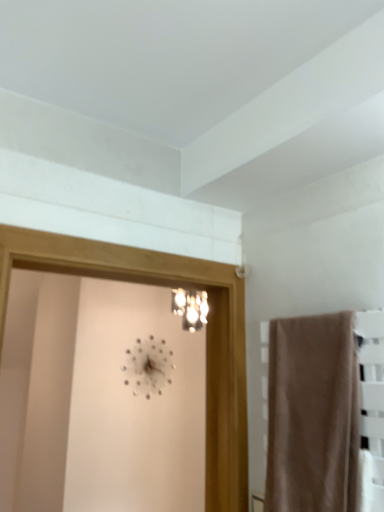
Find the location of a particular element. beige fabric towel at right is located at coordinates (313, 414).

Describe the element at coordinates (206, 336) in the screenshot. I see `clear glass screen door at center` at that location.

Describe the element at coordinates (148, 367) in the screenshot. The height and width of the screenshot is (512, 384). I see `metallic silver clock at upper center` at that location.

Locate an element on the screen. beige fabric towel at right is located at coordinates tap(313, 414).

Between beige fabric towel at right and metallic silver clock at upper center, which one has larger size?

Bigger between the two is beige fabric towel at right.

From a real-world perspective, is beige fabric towel at right located beneath metallic silver clock at upper center?

Indeed, from a real-world perspective, beige fabric towel at right is positioned beneath metallic silver clock at upper center.

How many degrees apart are the facing directions of beige fabric towel at right and metallic silver clock at upper center?

The facing directions of beige fabric towel at right and metallic silver clock at upper center are 90.5 degrees apart.

Considering the positions of objects beige fabric towel at right and metallic silver clock at upper center in the image provided, who is behind, beige fabric towel at right or metallic silver clock at upper center?

metallic silver clock at upper center is behind.

You are a GUI agent. You are given a task and a screenshot of the screen. Output one action in this format:
    pyautogui.click(x=<x>, y=<y>)
    Task: Click on the clock that appears below the clear glass screen door at center (from the image's perspective)
    Image resolution: width=384 pixels, height=512 pixels.
    Given the screenshot: What is the action you would take?
    pyautogui.click(x=148, y=367)

Is clear glass screen door at center positioned with its back to metallic silver clock at upper center?

Yes.

Considering the relative sizes of clear glass screen door at center and metallic silver clock at upper center in the image provided, is clear glass screen door at center taller than metallic silver clock at upper center?

Yes.

From the image's perspective, which is above, clear glass screen door at center or metallic silver clock at upper center?

clear glass screen door at center.

Between metallic silver clock at upper center and beige fabric towel at right, which one has smaller width?

With smaller width is metallic silver clock at upper center.

Which object is further away from the camera, metallic silver clock at upper center or beige fabric towel at right?

metallic silver clock at upper center is further from the camera.

Which object is positioned more to the right, metallic silver clock at upper center or beige fabric towel at right?

beige fabric towel at right is more to the right.

Could you tell me if metallic silver clock at upper center is turned towards beige fabric towel at right?

Yes, metallic silver clock at upper center is turned towards beige fabric towel at right.

Is clear glass screen door at center at the back of metallic silver clock at upper center?

That's not correct — metallic silver clock at upper center is not looking away from clear glass screen door at center.

The image size is (384, 512). In order to click on screen door in front of the metallic silver clock at upper center in this screenshot , I will do `click(206, 336)`.

Is metallic silver clock at upper center bigger or smaller than clear glass screen door at center?

metallic silver clock at upper center is smaller than clear glass screen door at center.

Is point (161, 387) closer or farther from the camera than point (94, 271)?

Point (161, 387) is positioned farther from the camera compared to point (94, 271).

Is beige fabric towel at right positioned in front of clear glass screen door at center?

Yes, the depth of beige fabric towel at right is less than that of clear glass screen door at center.

Which of these two, beige fabric towel at right or clear glass screen door at center, is thinner?

beige fabric towel at right is thinner.

From their relative heights in the image, would you say beige fabric towel at right is taller or shorter than clear glass screen door at center?

Clearly, beige fabric towel at right is shorter compared to clear glass screen door at center.

From the picture: Is beige fabric towel at right facing towards clear glass screen door at center?

No.

Is clear glass screen door at center far from beige fabric towel at right?

No, clear glass screen door at center is not far from beige fabric towel at right.

In the scene shown: From the image's perspective, is clear glass screen door at center located above or below beige fabric towel at right?

clear glass screen door at center is above beige fabric towel at right.

Which point is more forward, (x=5, y=307) or (x=342, y=393)?

The point (x=342, y=393) is more forward.

How different are the orientations of clear glass screen door at center and beige fabric towel at right in degrees?

The angular difference between clear glass screen door at center and beige fabric towel at right is 91.1 degrees.

I want to click on clock that is on the left side of beige fabric towel at right, so click(148, 367).

At what (x,y) coordinates should I click in order to perform the action: click on screen door on the right of the metallic silver clock at upper center. Please return your answer as a coordinate pair (x, y). Looking at the image, I should click on (206, 336).

Based on the photo, based on their spatial positions, is clear glass screen door at center or metallic silver clock at upper center further from beige fabric towel at right?

metallic silver clock at upper center is positioned further to the anchor beige fabric towel at right.

Looking at the image, which one is located closer to metallic silver clock at upper center, beige fabric towel at right or clear glass screen door at center?

The object closer to metallic silver clock at upper center is clear glass screen door at center.

Looking at the image, which one is located further to beige fabric towel at right, metallic silver clock at upper center or clear glass screen door at center?

metallic silver clock at upper center lies further to beige fabric towel at right than the other object.

From the picture: Considering their positions, is metallic silver clock at upper center positioned further to clear glass screen door at center than beige fabric towel at right?

The object further to clear glass screen door at center is metallic silver clock at upper center.

Estimate the real-world distances between objects in this image. Which object is further from metallic silver clock at upper center, clear glass screen door at center or beige fabric towel at right?

beige fabric towel at right is positioned further to the anchor metallic silver clock at upper center.

From the image, which object appears to be nearer to clear glass screen door at center, beige fabric towel at right or metallic silver clock at upper center?

beige fabric towel at right is positioned closer to the anchor clear glass screen door at center.

Image resolution: width=384 pixels, height=512 pixels. In order to click on screen door between beige fabric towel at right and metallic silver clock at upper center from front to back in this screenshot , I will do `click(206, 336)`.